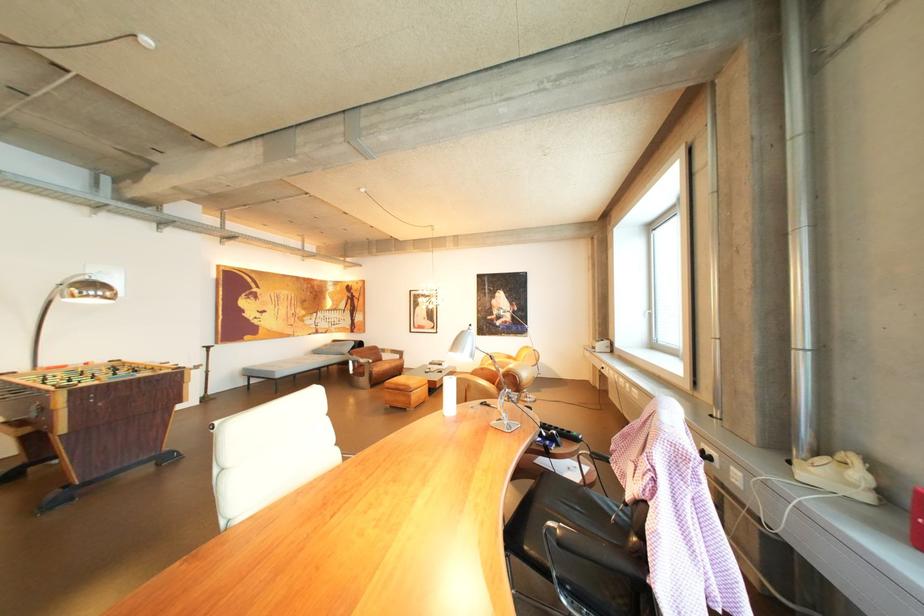
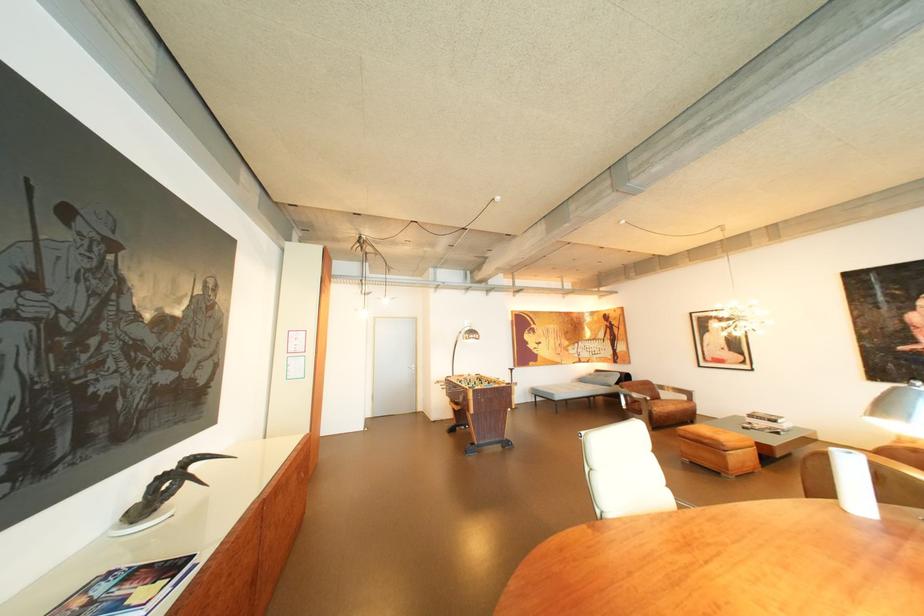
The point at (452, 407) is marked in the first image. Where is the corresponding point in the second image?

(839, 491)